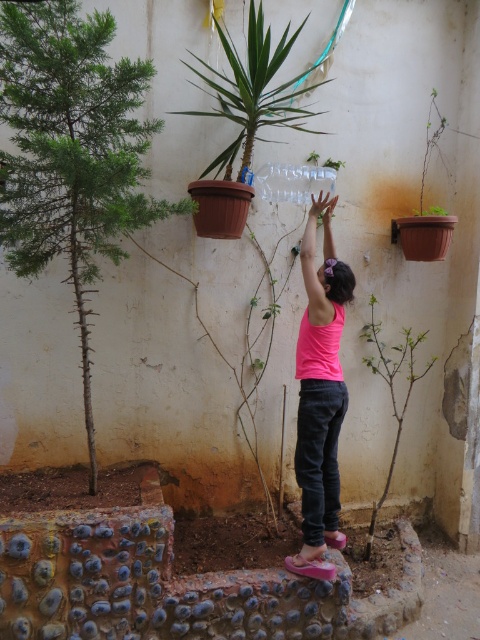
Does green spiky tree at lower left lie behind pink matte tank top at center?

That is False.

Locate an element on the screen. The height and width of the screenshot is (640, 480). green spiky tree at lower left is located at coordinates (72, 152).

Where is `green spiky tree at lower left`? green spiky tree at lower left is located at coordinates (72, 152).